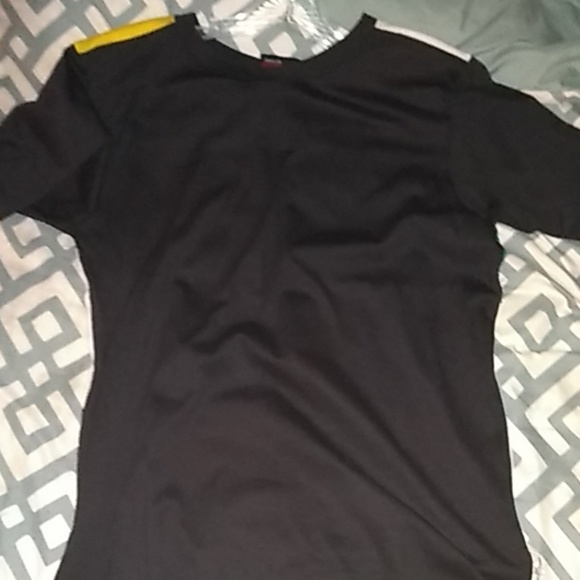
The width and height of the screenshot is (580, 580). Find the location of `sheet`. sheet is located at coordinates (528, 39).